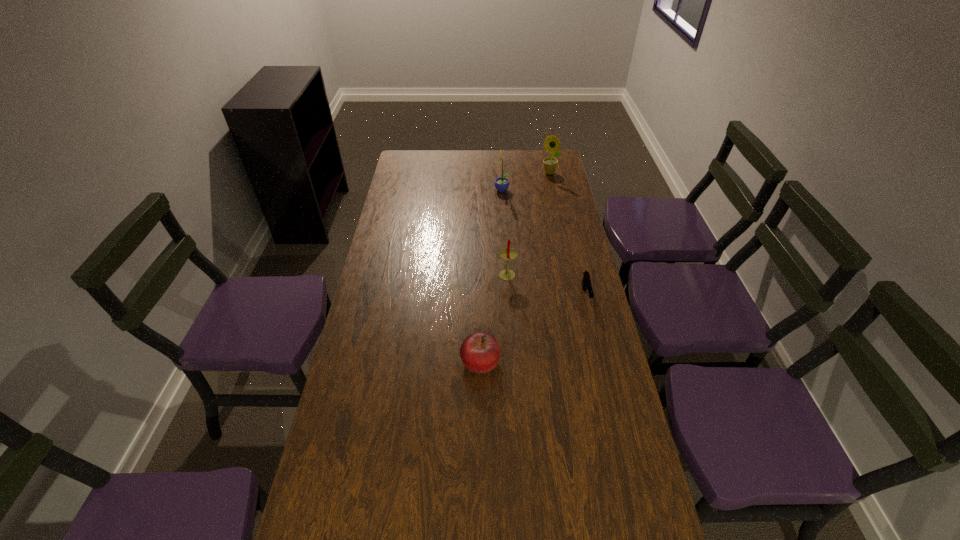
Locate an element on the screen. The width and height of the screenshot is (960, 540). free space located 0.060m on the front-facing side of the nearer sunflower is located at coordinates (481, 191).

The height and width of the screenshot is (540, 960). What are the coordinates of `vacant space located 0.070m on the front-facing side of the nearer sunflower` in the screenshot? It's located at (479, 191).

At what (x,y) coordinates should I click in order to perform the action: click on vacant area situated 0.090m on the front of the candle. Please return your answer as a coordinate pair (x, y). Looking at the image, I should click on (509, 303).

Where is `vacant space situated on the back of the apple`? vacant space situated on the back of the apple is located at coordinates (480, 286).

The height and width of the screenshot is (540, 960). What are the coordinates of `vacant area situated on the front-facing side of the shortest object` in the screenshot? It's located at (592, 321).

At what (x,y) coordinates should I click in order to perform the action: click on object located at the far edge. Please return your answer as a coordinate pair (x, y). The width and height of the screenshot is (960, 540). Looking at the image, I should click on (552, 144).

Find the location of a particular element. Image resolution: width=960 pixels, height=540 pixels. sunflower that is at the right edge is located at coordinates (552, 144).

Locate an element on the screen. This screenshot has height=540, width=960. pistol situated at the right edge is located at coordinates (586, 281).

Where is `object located at the far right corner`? This screenshot has width=960, height=540. object located at the far right corner is located at coordinates (552, 144).

What are the coordinates of `blank space at the far edge` in the screenshot? It's located at (473, 159).